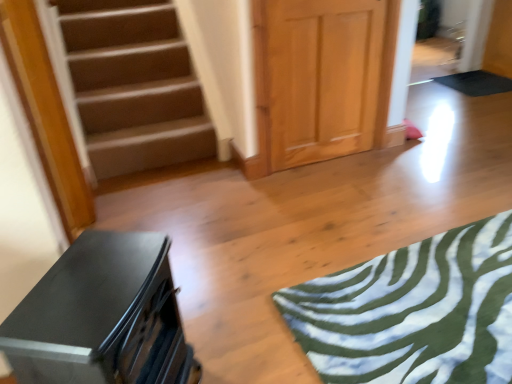
What do you see at coordinates (413, 312) in the screenshot? I see `green fabric yoga mat at lower right, arranged as the 1th yoga mat when viewed from the left` at bounding box center [413, 312].

You are a GUI agent. You are given a task and a screenshot of the screen. Output one action in this format:
    pyautogui.click(x=<x>, y=<y>)
    Task: Click on the matte black dresser at lower left
    The width and height of the screenshot is (512, 384).
    Given the screenshot: What is the action you would take?
    pyautogui.click(x=102, y=316)

Identify the location of green fabric yoga mat at lower right, the 1th yoga mat from the front. (413, 312).

Considering the positions of point (177, 366) and point (348, 45), is point (177, 366) closer or farther from the camera than point (348, 45)?

Point (177, 366) is positioned closer to the camera compared to point (348, 45).

Can you tell me how much matte black dresser at lower left and light wood paneling at center differ in facing direction?

matte black dresser at lower left and light wood paneling at center are facing 60.4 degrees away from each other.

Considering the relative sizes of matte black dresser at lower left and light wood paneling at center in the image provided, is matte black dresser at lower left thinner than light wood paneling at center?

No, matte black dresser at lower left is not thinner than light wood paneling at center.

Measure the distance from matte black dresser at lower left to light wood paneling at center.

matte black dresser at lower left and light wood paneling at center are 4.96 feet apart.

From the image's perspective, is black rubber yoga mat at upper right, the 1th yoga mat when ordered from top to bottom, positioned above or below matte black dresser at lower left?

black rubber yoga mat at upper right, the 1th yoga mat when ordered from top to bottom, is situated higher than matte black dresser at lower left in the image.

Which object is closer to the camera, black rubber yoga mat at upper right, the 2th yoga mat from the left, or matte black dresser at lower left?

Positioned in front is matte black dresser at lower left.

Which is more to the right, black rubber yoga mat at upper right, placed as the first yoga mat when sorted from back to front, or matte black dresser at lower left?

black rubber yoga mat at upper right, placed as the first yoga mat when sorted from back to front, is more to the right.

Between black rubber yoga mat at upper right, the 1th yoga mat when ordered from top to bottom, and matte black dresser at lower left, which one has smaller width?

With smaller width is matte black dresser at lower left.

Can you tell me how much green fabric yoga mat at lower right, the 1th yoga mat from the front, and light wood paneling at center differ in facing direction?

They differ by 177 degrees in their facing directions.

Does green fabric yoga mat at lower right, marked as the second yoga mat in a right-to-left arrangement, appear on the left side of light wood paneling at center?

No.

Between green fabric yoga mat at lower right, which is the second yoga mat in back-to-front order, and light wood paneling at center, which one has more height?

light wood paneling at center is taller.

From the image's perspective, is green fabric yoga mat at lower right, which is the second yoga mat in back-to-front order, on top of light wood paneling at center?

No, from the image's perspective, green fabric yoga mat at lower right, which is the second yoga mat in back-to-front order, is not on top of light wood paneling at center.

Is green fabric yoga mat at lower right, arranged as the 1th yoga mat when viewed from the left, smaller than matte black dresser at lower left?

Yes.

Which is correct: green fabric yoga mat at lower right, which is the second yoga mat in back-to-front order, is inside matte black dresser at lower left, or outside of it?

green fabric yoga mat at lower right, which is the second yoga mat in back-to-front order, is spatially situated outside matte black dresser at lower left.

Are matte black dresser at lower left and black rubber yoga mat at upper right, the 2th yoga mat from the left, beside each other?

matte black dresser at lower left and black rubber yoga mat at upper right, the 2th yoga mat from the left, are clearly separated.

Is matte black dresser at lower left oriented towards black rubber yoga mat at upper right, which is counted as the first yoga mat, starting from the right?

No, matte black dresser at lower left is not turned towards black rubber yoga mat at upper right, which is counted as the first yoga mat, starting from the right.

From the image's perspective, is matte black dresser at lower left beneath black rubber yoga mat at upper right, the 2th yoga mat viewed from the front?

Yes.

You are a GUI agent. You are given a task and a screenshot of the screen. Output one action in this format:
    pyautogui.click(x=<x>, y=<y>)
    Task: Click on the yoga mat that appears in front of the light wood paneling at center
    The width and height of the screenshot is (512, 384).
    Given the screenshot: What is the action you would take?
    (x=413, y=312)

Does light wood paneling at center have a greater width compared to green fabric yoga mat at lower right, the 1th yoga mat from the front?

In fact, light wood paneling at center might be narrower than green fabric yoga mat at lower right, the 1th yoga mat from the front.

Based on the photo, who is shorter, light wood paneling at center or green fabric yoga mat at lower right, which ranks as the 1th yoga mat in bottom-to-top order?

Standing shorter between the two is green fabric yoga mat at lower right, which ranks as the 1th yoga mat in bottom-to-top order.

Which object is more forward, light wood paneling at center or green fabric yoga mat at lower right, marked as the second yoga mat in a right-to-left arrangement?

green fabric yoga mat at lower right, marked as the second yoga mat in a right-to-left arrangement, is closer to the camera.

Can you tell me how much light wood paneling at center and black rubber yoga mat at upper right, the 2th yoga mat from the left, differ in facing direction?

91.4 degrees separate the facing orientations of light wood paneling at center and black rubber yoga mat at upper right, the 2th yoga mat from the left.

Are light wood paneling at center and black rubber yoga mat at upper right, the 2th yoga mat from the left, making contact?

There is a gap between light wood paneling at center and black rubber yoga mat at upper right, the 2th yoga mat from the left.

Based on their sizes in the image, would you say light wood paneling at center is bigger or smaller than black rubber yoga mat at upper right, the 2th yoga mat ordered from the bottom?

light wood paneling at center is bigger than black rubber yoga mat at upper right, the 2th yoga mat ordered from the bottom.

Considering the relative sizes of light wood paneling at center and black rubber yoga mat at upper right, the 2th yoga mat ordered from the bottom, in the image provided, is light wood paneling at center thinner than black rubber yoga mat at upper right, the 2th yoga mat ordered from the bottom,?

Yes, light wood paneling at center is thinner than black rubber yoga mat at upper right, the 2th yoga mat ordered from the bottom.

At what (x,y) coordinates should I click in order to perform the action: click on furniture that appears below the light wood paneling at center (from the image's perspective). Please return your answer as a coordinate pair (x, y). The width and height of the screenshot is (512, 384). Looking at the image, I should click on (102, 316).

Find the location of `yoga mat that is the 2nd one when counting upward from the matte black dresser at lower left (from the image's perspective)`. yoga mat that is the 2nd one when counting upward from the matte black dresser at lower left (from the image's perspective) is located at coordinates (476, 83).

Which object lies nearer to the anchor point light wood paneling at center, matte black dresser at lower left or black rubber yoga mat at upper right, which is counted as the first yoga mat, starting from the right?

matte black dresser at lower left is positioned closer to the anchor light wood paneling at center.

Considering their positions, is black rubber yoga mat at upper right, which is counted as the first yoga mat, starting from the right, positioned closer to light wood paneling at center than green fabric yoga mat at lower right, the 1th yoga mat from the front?

green fabric yoga mat at lower right, the 1th yoga mat from the front, lies closer to light wood paneling at center than the other object.

Based on their spatial positions, is black rubber yoga mat at upper right, the 2th yoga mat ordered from the bottom, or green fabric yoga mat at lower right, which is the second yoga mat in back-to-front order, further from matte black dresser at lower left?

black rubber yoga mat at upper right, the 2th yoga mat ordered from the bottom, is positioned further to the anchor matte black dresser at lower left.

From the image, which object appears to be farther from light wood paneling at center, black rubber yoga mat at upper right, the 2th yoga mat ordered from the bottom, or matte black dresser at lower left?

Among the two, black rubber yoga mat at upper right, the 2th yoga mat ordered from the bottom, is located further to light wood paneling at center.

Which object lies further to the anchor point green fabric yoga mat at lower right, the 2th yoga mat from the top, matte black dresser at lower left or black rubber yoga mat at upper right, the 2th yoga mat from the left?

black rubber yoga mat at upper right, the 2th yoga mat from the left, lies further to green fabric yoga mat at lower right, the 2th yoga mat from the top, than the other object.

Looking at the image, which one is located closer to green fabric yoga mat at lower right, which ranks as the 1th yoga mat in bottom-to-top order, black rubber yoga mat at upper right, the 2th yoga mat viewed from the front, or matte black dresser at lower left?

The object closer to green fabric yoga mat at lower right, which ranks as the 1th yoga mat in bottom-to-top order, is matte black dresser at lower left.

Considering their positions, is green fabric yoga mat at lower right, arranged as the 1th yoga mat when viewed from the left, positioned closer to matte black dresser at lower left than light wood paneling at center?

Based on the image, green fabric yoga mat at lower right, arranged as the 1th yoga mat when viewed from the left, appears to be nearer to matte black dresser at lower left.

Estimate the real-world distances between objects in this image. Which object is further from black rubber yoga mat at upper right, placed as the first yoga mat when sorted from back to front, matte black dresser at lower left or light wood paneling at center?

matte black dresser at lower left.

Locate an element on the screen. The image size is (512, 384). yoga mat between matte black dresser at lower left and light wood paneling at center from front to back is located at coordinates (413, 312).

Where is `door between matte black dresser at lower left and black rubber yoga mat at upper right, the 1th yoga mat when ordered from top to bottom, in the front-back direction`? Image resolution: width=512 pixels, height=384 pixels. door between matte black dresser at lower left and black rubber yoga mat at upper right, the 1th yoga mat when ordered from top to bottom, in the front-back direction is located at coordinates point(321,78).

The image size is (512, 384). What are the coordinates of `door positioned between green fabric yoga mat at lower right, which ranks as the 1th yoga mat in bottom-to-top order, and black rubber yoga mat at upper right, the 2th yoga mat viewed from the front, from near to far` in the screenshot? It's located at (321, 78).

Locate an element on the screen. The width and height of the screenshot is (512, 384). yoga mat between matte black dresser at lower left and black rubber yoga mat at upper right, the 1th yoga mat when ordered from top to bottom, along the z-axis is located at coordinates (413, 312).